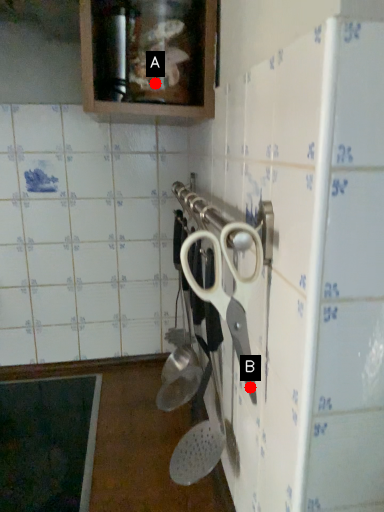
Question: Two points are circled on the image, labeled by A and B beside each circle. Among these points, which one is farthest from the camera?

Choices:
 (A) A is further
 (B) B is further

Answer: (A)